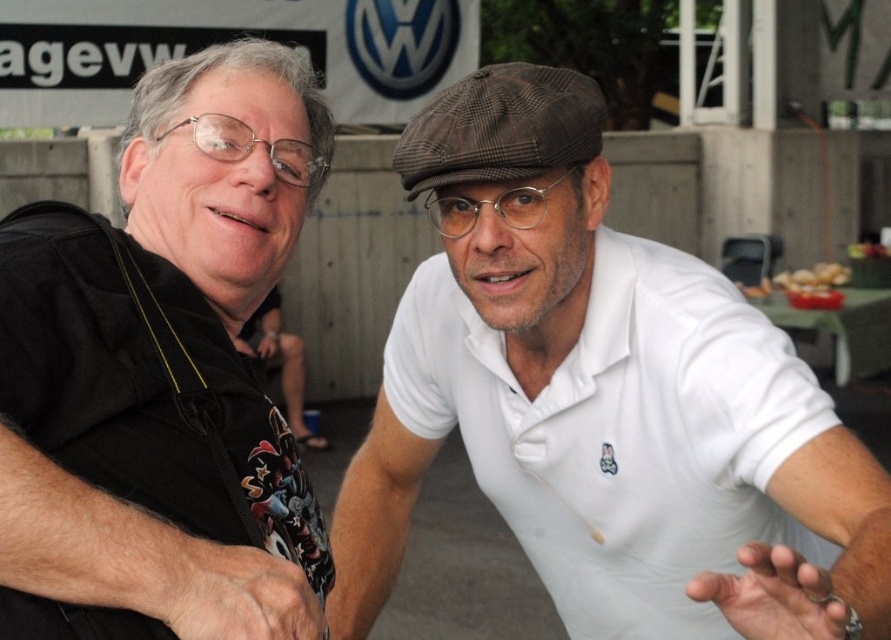
Looking at this image, you are a photographer trying to capture a closeup of both the black matte shirt at left and the brown crumbly bread at right. Given that the camera can only focus on one object at a time, which object should you focus on first to ensure the smaller one is in focus?

The black matte shirt at left has a lesser width compared to brown crumbly bread at right, so you should focus on the black matte shirt at left first since it is smaller and requires precise focus.

You are standing at the point with coordinates closest to the bottom of the image. You want to walk towards the person on the right. Which of the two points, point (830, 406) or point (826, 285), should you aim for to reach the person on the right?

You should aim for point (830, 406) because it is in front of point (826, 285), meaning it is closer to the person on the right.